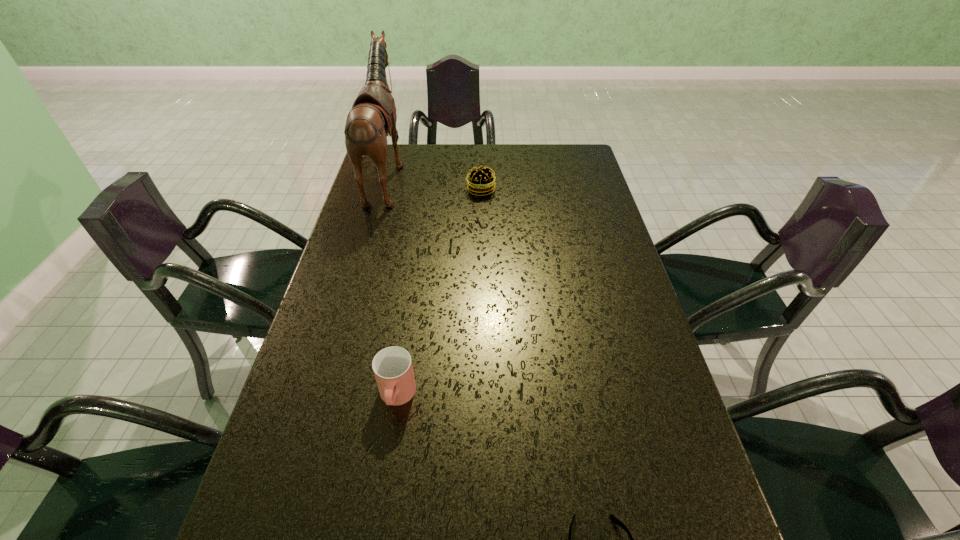
Where is `object situated at the left edge`? object situated at the left edge is located at coordinates (372, 118).

At what (x,y) coordinates should I click in order to perform the action: click on object at the far left corner. Please return your answer as a coordinate pair (x, y). Looking at the image, I should click on (372, 118).

The width and height of the screenshot is (960, 540). I want to click on free location at the far edge, so click(x=492, y=146).

Identify the location of vacant position at the right edge of the desktop. The image size is (960, 540). (619, 376).

The height and width of the screenshot is (540, 960). What are the coordinates of `blank space at the far right corner of the desktop` in the screenshot? It's located at (582, 152).

Where is `free area in between the third shortest object and the tallest object`? The image size is (960, 540). free area in between the third shortest object and the tallest object is located at coordinates (392, 286).

Where is `free area in between the saddle and the third object from left to right`? The image size is (960, 540). free area in between the saddle and the third object from left to right is located at coordinates (434, 183).

Find the location of `vacant space in between the third object from left to right and the second tallest object`. vacant space in between the third object from left to right and the second tallest object is located at coordinates (439, 293).

Where is `free space between the third object from right to left and the tallest object`? The image size is (960, 540). free space between the third object from right to left and the tallest object is located at coordinates (392, 286).

Locate an element on the screen. This screenshot has width=960, height=540. free space between the tallest object and the third tallest object is located at coordinates (434, 183).